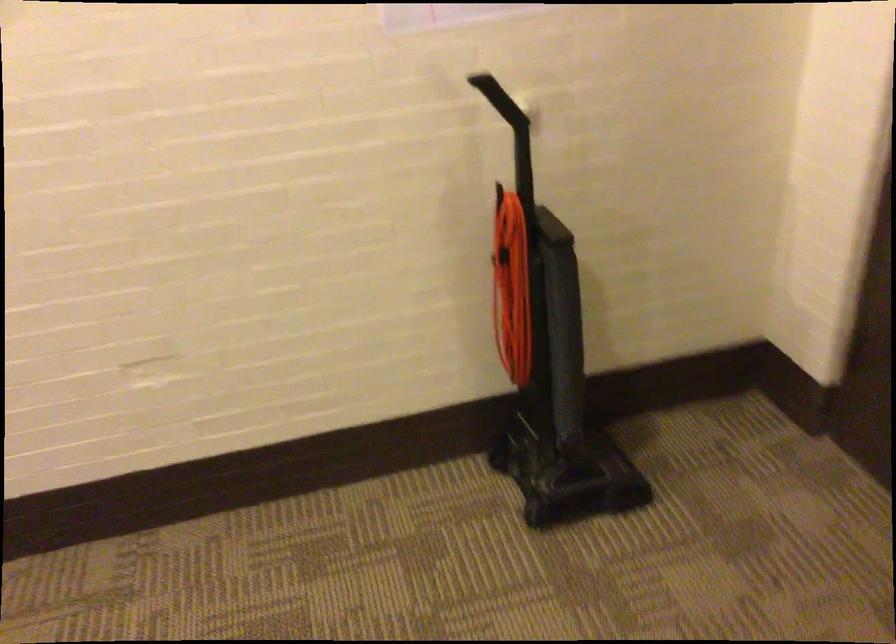
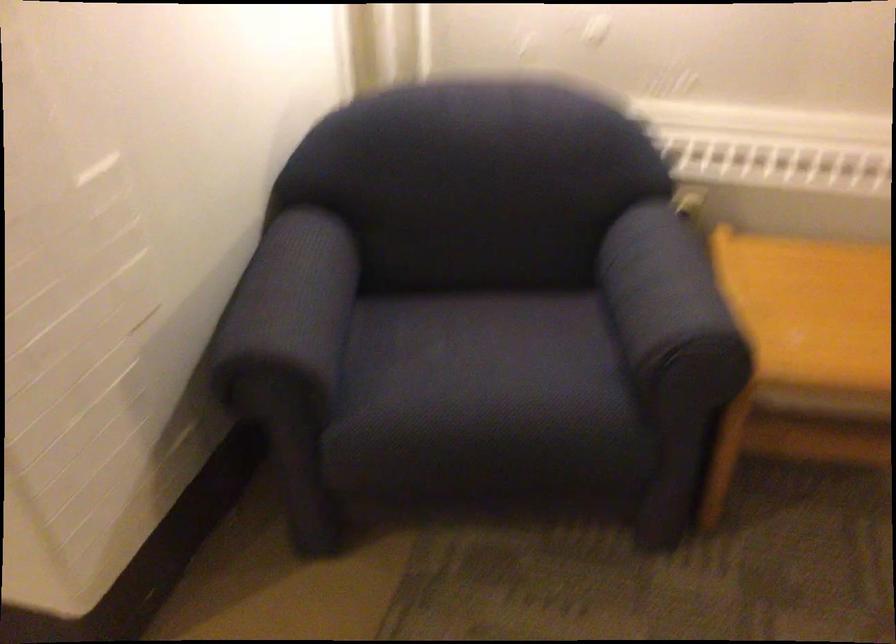
From the picture: How did the camera likely rotate?

The camera rotated toward right-down.